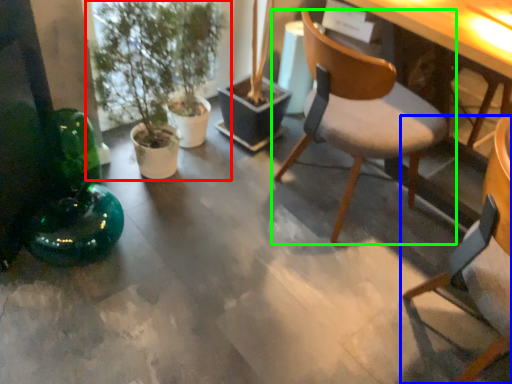
Question: Which object is positioned farthest from houseplant (highlighted by a red box)? Select from chair (highlighted by a blue box) and chair (highlighted by a green box).

Choices:
 (A) chair
 (B) chair

Answer: (A)